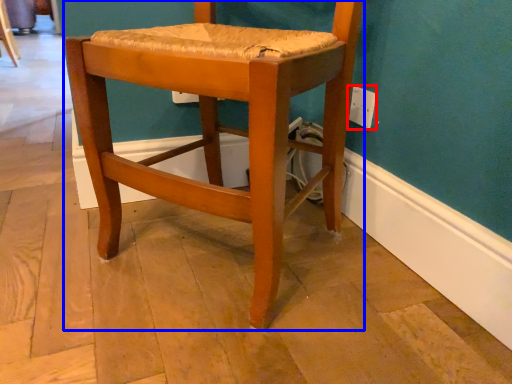
Question: Among these objects, which one is farthest to the camera, electric outlet (highlighted by a red box) or chair (highlighted by a blue box)?

Choices:
 (A) electric outlet
 (B) chair

Answer: (A)